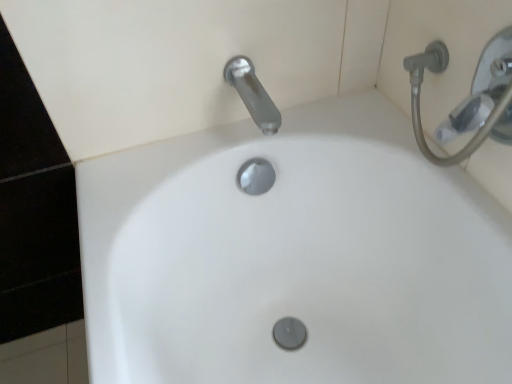
Question: Relative to satin nickel faucet at upper center, is white glossy sink at center in front or behind?

Choices:
 (A) front
 (B) behind

Answer: (A)

Question: Based on their sizes in the image, would you say white glossy sink at center is bigger or smaller than satin nickel faucet at upper center?

Choices:
 (A) small
 (B) big

Answer: (B)

Question: Which is nearer to the silver metallic shower head at upper right?

Choices:
 (A) satin nickel faucet at upper center
 (B) white glossy sink at center

Answer: (A)

Question: Considering the real-world distances, which object is closest to the silver metallic shower head at upper right?

Choices:
 (A) satin nickel faucet at upper center
 (B) white glossy sink at center

Answer: (A)